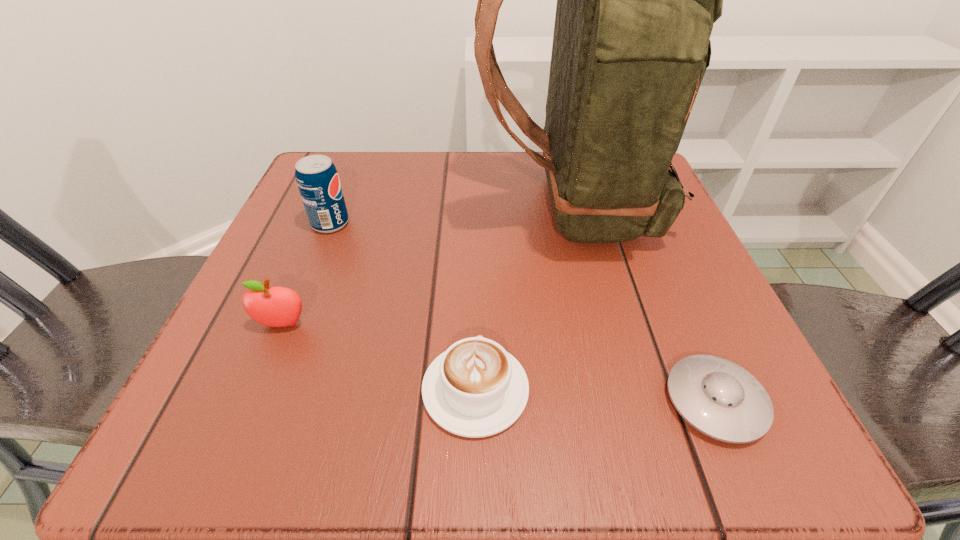
In the image, there is a desktop. Where is `vacant space at the near left corner`? This screenshot has height=540, width=960. vacant space at the near left corner is located at coordinates [267, 449].

I want to click on free space between the cappuccino and the saucer, so click(595, 396).

The image size is (960, 540). I want to click on vacant region between the second tallest object and the cappuccino, so click(403, 307).

Locate an element on the screen. The height and width of the screenshot is (540, 960). free spot between the pop and the shortest object is located at coordinates (523, 312).

At what (x,y) coordinates should I click in order to perform the action: click on vacant area that lies between the pop and the second shortest object. Please return your answer as a coordinate pair (x, y). Image resolution: width=960 pixels, height=540 pixels. Looking at the image, I should click on (403, 307).

At what (x,y) coordinates should I click in order to perform the action: click on vacant area between the fourth shortest object and the cappuccino. Please return your answer as a coordinate pair (x, y). Image resolution: width=960 pixels, height=540 pixels. Looking at the image, I should click on (403, 307).

In order to click on vacant region between the cappuccino and the third farthest object in this screenshot , I will do `click(379, 357)`.

Where is `empty location between the pop and the third shortest object`? empty location between the pop and the third shortest object is located at coordinates (306, 274).

The height and width of the screenshot is (540, 960). I want to click on free space between the shortest object and the pop, so click(x=523, y=312).

Locate an element on the screen. This screenshot has width=960, height=540. the closest object to the apple is located at coordinates pyautogui.click(x=474, y=389).